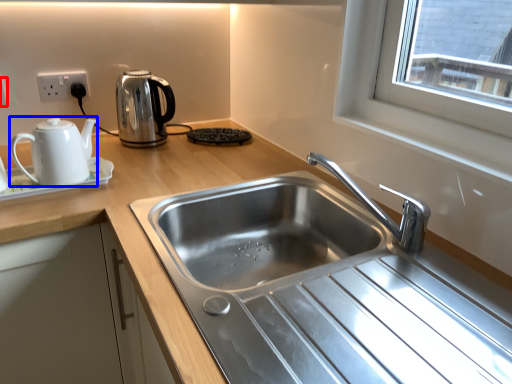
Question: Among these objects, which one is farthest to the camera, electric outlet (highlighted by a red box) or kettle (highlighted by a blue box)?

Choices:
 (A) electric outlet
 (B) kettle

Answer: (A)